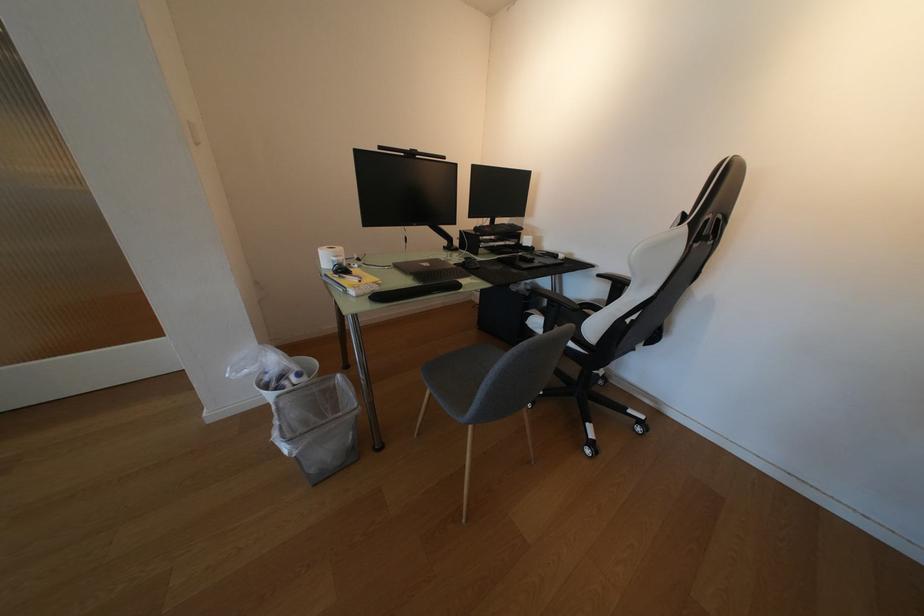
Find the location of a particular element. This screenshot has width=924, height=616. white chair sitting surface is located at coordinates (469, 369).